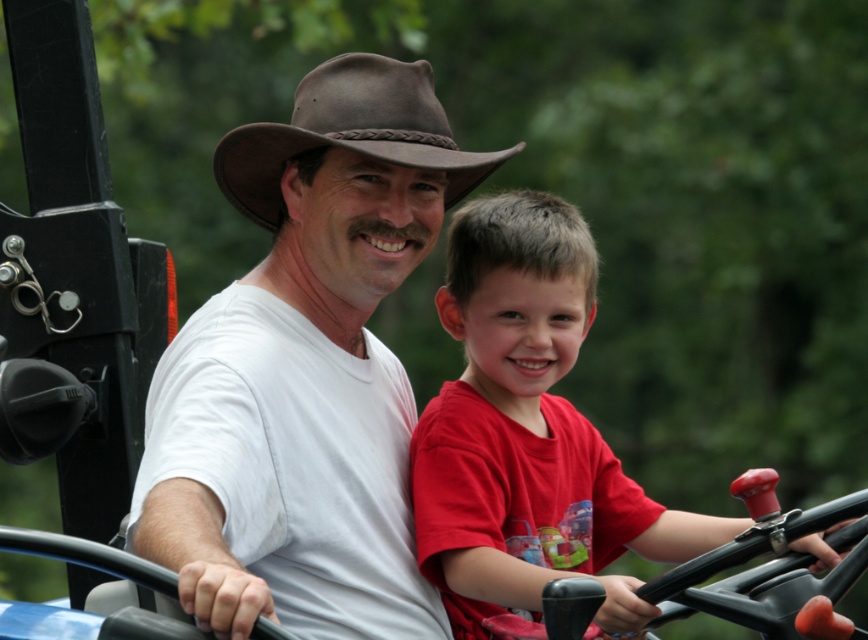
You are a photographer who wants to capture a photo of the red matte shirt at center and the brown leather fedora at center. Based on their positions, which object is located to the left?

The brown leather fedora at center is located to the left of the red matte shirt at center.

You are designing a photo frame that needs to accommodate both the white matte shirt at center and the red matte shirt at center. If the frame has a fixed width, which shirt should be placed in the frame first to ensure both can fit?

The red matte shirt at center should be placed in the frame first since the white matte shirt at center might be wider, leaving enough space for it afterward.

You are a photographer trying to capture a candid shot of the two people in the image. You want to focus on the person closer to the camera. Which one should you aim for between the white matte shirt at center and the red matte shirt at center?

The white matte shirt at center is closer to the viewer than the red matte shirt at center, so you should aim for the white matte shirt at center to focus on the person closer to the camera.